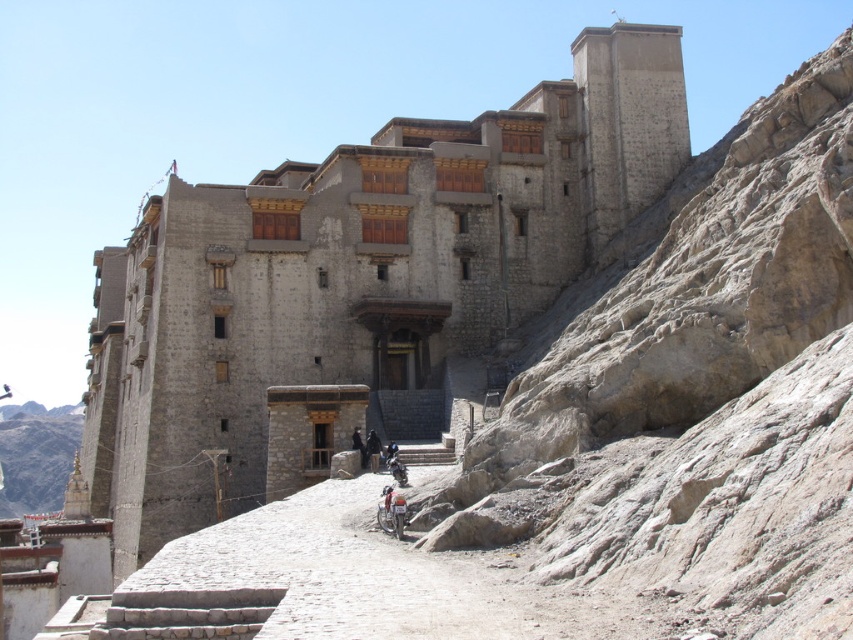
Question: Can you confirm if metallic silver motorcycle at center is positioned to the left of shiny metallic motorcycle at center?

Choices:
 (A) yes
 (B) no

Answer: (A)

Question: Which of the following is the closest to the observer?

Choices:
 (A) (399, 516)
 (B) (339, 326)
 (C) (399, 476)

Answer: (A)

Question: Which of these objects is positioned closest to the shiny metallic motorcycle at center?

Choices:
 (A) metallic silver motorcycle at center
 (B) gray stone building at center

Answer: (A)

Question: Is gray stone building at center below white stone stupa at lower left?

Choices:
 (A) yes
 (B) no

Answer: (B)

Question: Which point is closer to the camera?

Choices:
 (A) pos(389,461)
 (B) pos(392,493)
 (C) pos(51,458)

Answer: (B)

Question: Does white stone stupa at lower left appear on the left side of shiny metallic motorcycle at center?

Choices:
 (A) yes
 (B) no

Answer: (A)